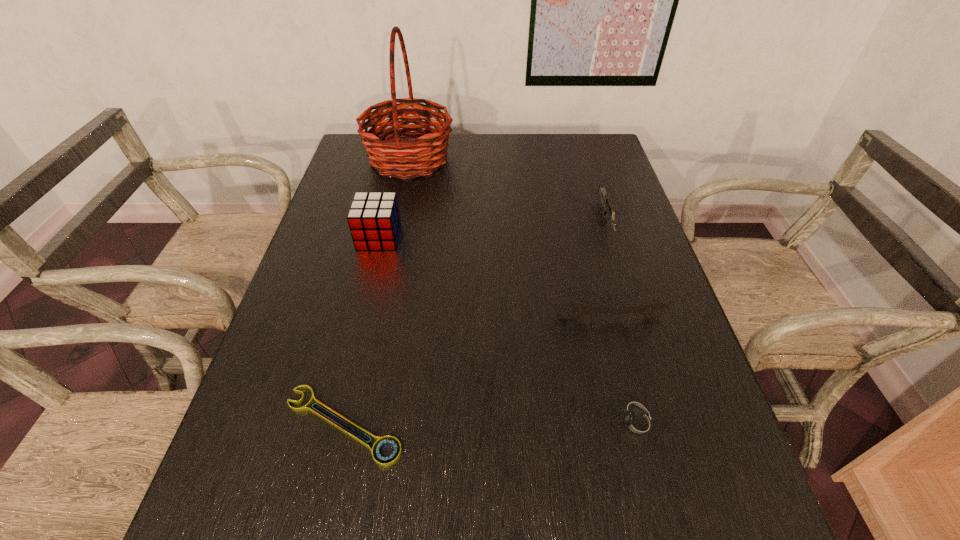
Find the location of a particular element. free space between the cube and the gun is located at coordinates (492, 228).

Where is `free space between the shortest object and the basket`? The width and height of the screenshot is (960, 540). free space between the shortest object and the basket is located at coordinates (376, 292).

What are the coordinates of `unoccupied position between the tallest object and the gun` in the screenshot? It's located at (508, 190).

Where is `vacant area that lies between the cube and the right wrench`? vacant area that lies between the cube and the right wrench is located at coordinates (494, 278).

Locate an element on the screen. free space between the fifth tallest object and the shortest object is located at coordinates click(491, 424).

Where is `empty location between the farthest object and the watch`? empty location between the farthest object and the watch is located at coordinates (523, 291).

Find the location of `unoccupied area between the farthest object and the taller wrench`. unoccupied area between the farthest object and the taller wrench is located at coordinates (509, 238).

You are a GUI agent. You are given a task and a screenshot of the screen. Output one action in this format:
    pyautogui.click(x=<x>, y=<y>)
    Task: Click on the free space between the gun and the second shortest object
    This screenshot has height=540, width=960.
    Given the screenshot: What is the action you would take?
    pyautogui.click(x=621, y=321)

Select which object appears as the fourth closest to the second shortest object. Please provide its 2D coordinates. Your answer should be formatted as a tuple, i.e. [(x, y)], where the tuple contains the x and y coordinates of a point satisfying the conditions above.

[(374, 220)]

Identify which object is the nearest to the fifth tallest object. Please provide its 2D coordinates. Your answer should be formatted as a tuple, i.e. [(x, y)], where the tuple contains the x and y coordinates of a point satisfying the conditions above.

[(646, 310)]